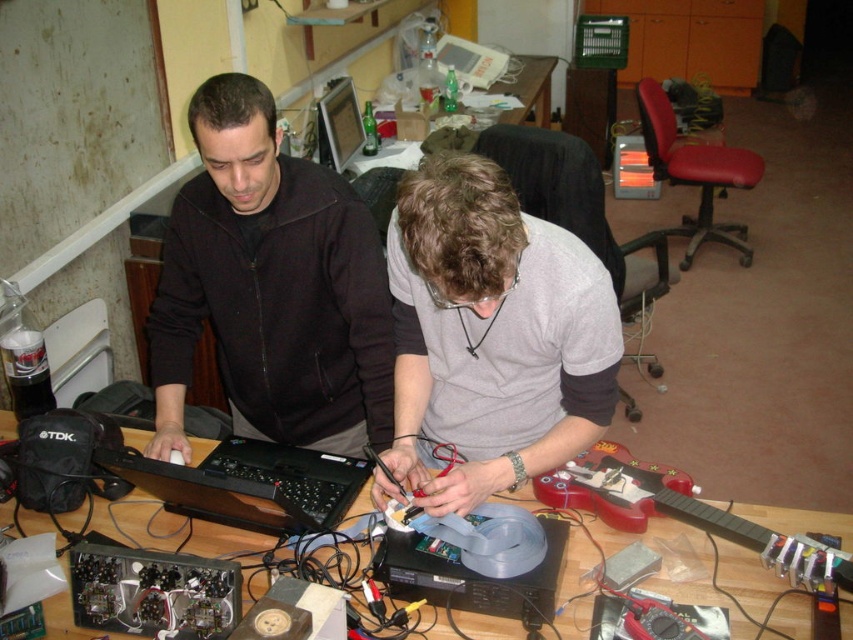
Based on the photo, you are a visitor in the workshop and want to use the black matte laptop at center. However, the black matte jacket at upper left is blocking it. Can you move the jacket to access the laptop?

The black matte jacket at upper left is positioned over the black matte laptop at center, so moving the jacket would allow access to the laptop.

You are standing in front of the desk and want to place a small tool on the point closer to the camera. Which point should you choose between point (271, 179) and point (363, 458)?

You should choose point (271, 179) because it is closer to the camera than point (363, 458).